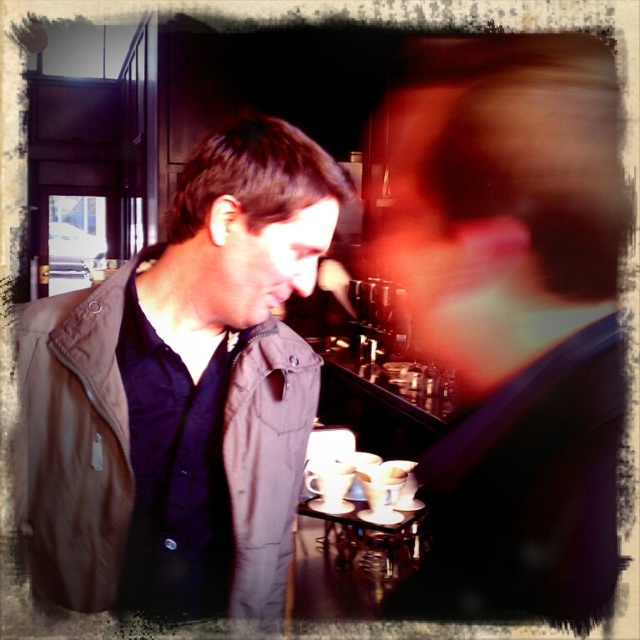
Which is above, smooth brown jacket at center or brown fabric jacket at left?

smooth brown jacket at center

How distant is smooth brown jacket at center from brown fabric jacket at left?

smooth brown jacket at center and brown fabric jacket at left are 4.92 feet apart.

Is point (428, 321) closer to camera compared to point (67, 339)?

No, it is behind (67, 339).

The height and width of the screenshot is (640, 640). Identify the location of smooth brown jacket at center. (509, 316).